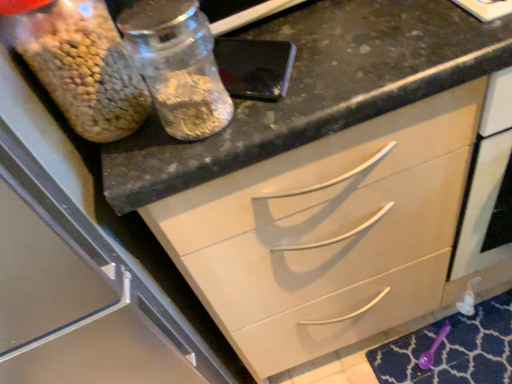
Question: Is purple plastic spoon at lower right next to black granite countertop at upper center and touching it?

Choices:
 (A) no
 (B) yes

Answer: (A)

Question: Is purple plastic spoon at lower right shorter than black granite countertop at upper center?

Choices:
 (A) yes
 (B) no

Answer: (A)

Question: Can you confirm if purple plastic spoon at lower right is positioned to the right of black granite countertop at upper center?

Choices:
 (A) yes
 (B) no

Answer: (A)

Question: Does purple plastic spoon at lower right have a greater height compared to black granite countertop at upper center?

Choices:
 (A) no
 (B) yes

Answer: (A)

Question: Does purple plastic spoon at lower right come behind black granite countertop at upper center?

Choices:
 (A) yes
 (B) no

Answer: (A)

Question: Is purple plastic spoon at lower right not near black granite countertop at upper center?

Choices:
 (A) yes
 (B) no

Answer: (B)

Question: Considering the relative positions of transparent glass jar at upper left and purple plastic spoon at lower right in the image provided, is transparent glass jar at upper left to the left of purple plastic spoon at lower right from the viewer's perspective?

Choices:
 (A) no
 (B) yes

Answer: (B)

Question: Is the position of transparent glass jar at upper left more distant than that of purple plastic spoon at lower right?

Choices:
 (A) no
 (B) yes

Answer: (A)

Question: Is transparent glass jar at upper left bigger than purple plastic spoon at lower right?

Choices:
 (A) yes
 (B) no

Answer: (A)

Question: From the image's perspective, is transparent glass jar at upper left above purple plastic spoon at lower right?

Choices:
 (A) yes
 (B) no

Answer: (A)

Question: Could purple plastic spoon at lower right be considered to be inside transparent glass jar at upper left?

Choices:
 (A) no
 (B) yes

Answer: (A)

Question: Does transparent glass jar at upper left have a lesser height compared to purple plastic spoon at lower right?

Choices:
 (A) yes
 (B) no

Answer: (B)

Question: Is translucent glass jar at upper left facing towards black granite countertop at upper center?

Choices:
 (A) no
 (B) yes

Answer: (A)